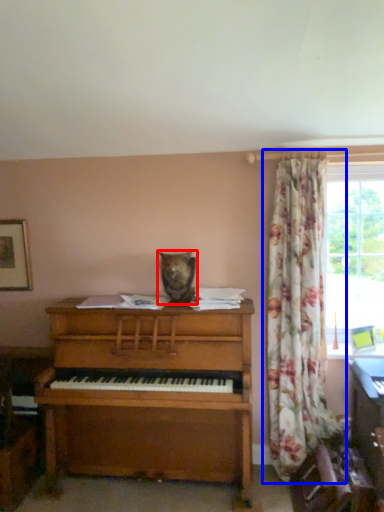
Question: Which point is closer to the camera, animal (highlighted by a red box) or curtain (highlighted by a blue box)?

Choices:
 (A) animal
 (B) curtain

Answer: (B)